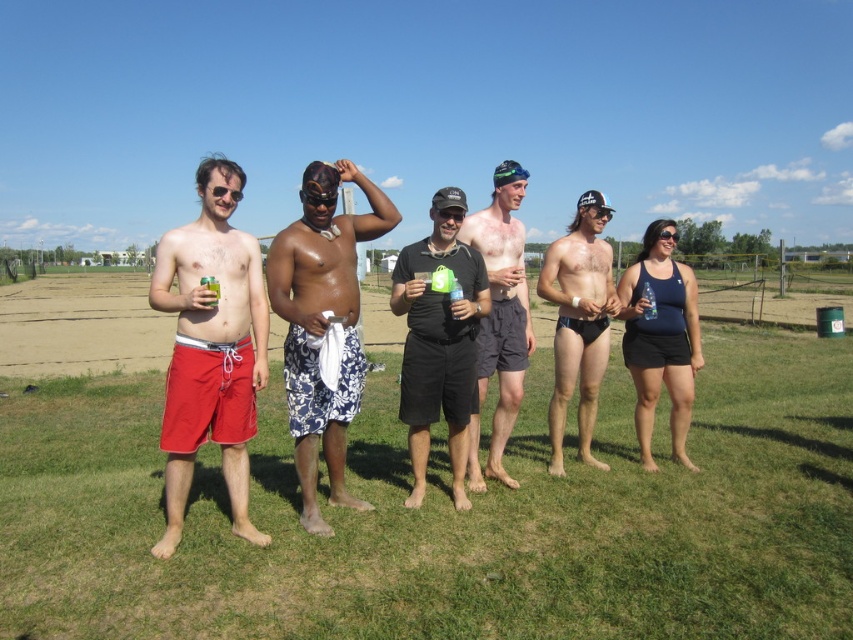
Who is shorter, matte red shorts at left or matte black swim trunks at center?

Standing shorter between the two is matte black swim trunks at center.

Does point (213, 326) come in front of point (592, 420)?

Yes, point (213, 326) is in front of point (592, 420).

Where is `matte red shorts at left`? Image resolution: width=853 pixels, height=640 pixels. matte red shorts at left is located at coordinates (212, 348).

Does green grass at center appear over black matte swimsuit at right?

No.

Is point (492, 509) positioned after point (622, 308)?

No, (492, 509) is closer to viewer.

I want to click on green grass at center, so click(x=447, y=516).

Describe the element at coordinates (212, 348) in the screenshot. I see `matte red shorts at left` at that location.

Is matte red shorts at left to the left of black matte shorts at center from the viewer's perspective?

Correct, you'll find matte red shorts at left to the left of black matte shorts at center.

The height and width of the screenshot is (640, 853). I want to click on matte red shorts at left, so click(212, 348).